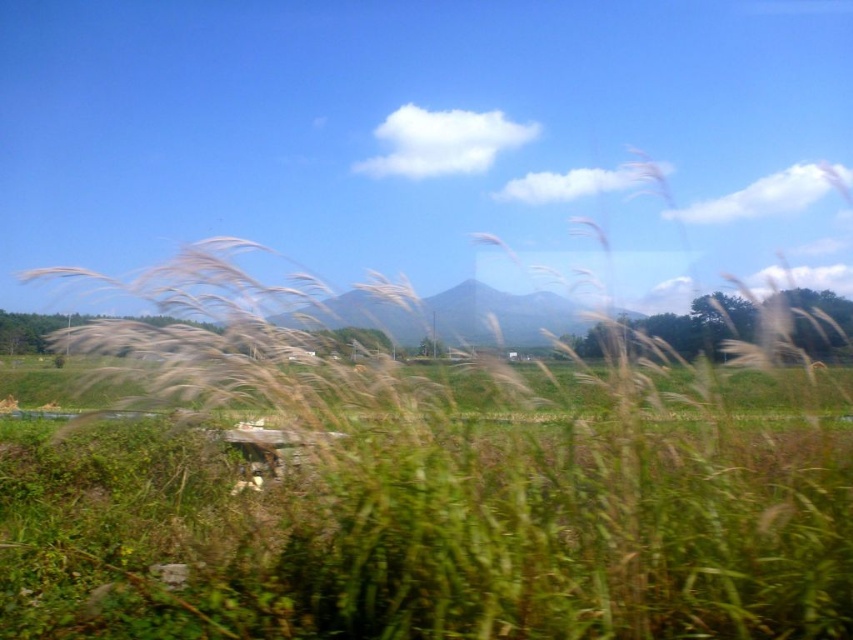
Question: Can you confirm if white fluffy grass at center is bigger than green matte mountain at center?

Choices:
 (A) yes
 (B) no

Answer: (A)

Question: Which object appears closest to the camera in this image?

Choices:
 (A) white fluffy grass at center
 (B) green matte mountain at center

Answer: (A)

Question: Where is white fluffy grass at center located in relation to green matte mountain at center in the image?

Choices:
 (A) above
 (B) below

Answer: (B)

Question: Does white fluffy grass at center appear over green matte mountain at center?

Choices:
 (A) no
 (B) yes

Answer: (A)